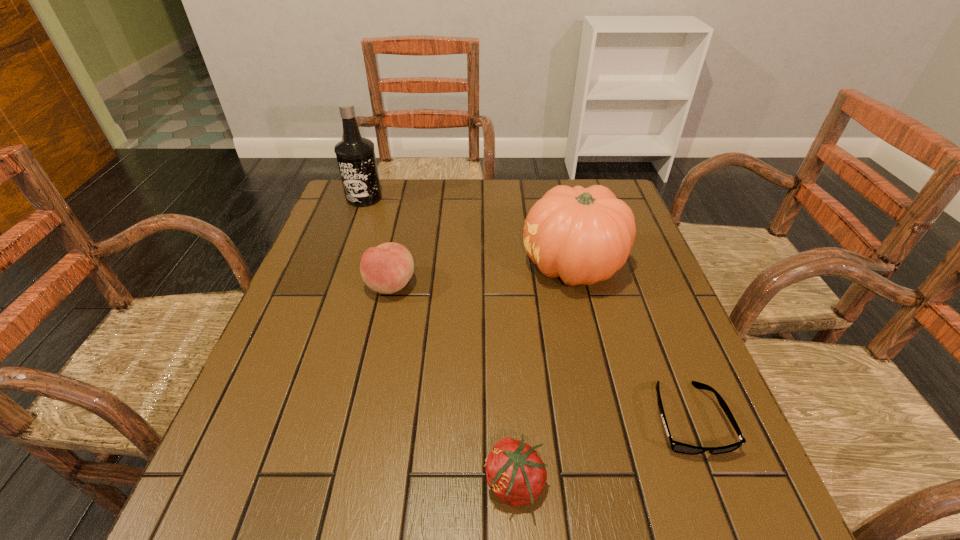
Where is `free space between the tomato and the sunglasses`? This screenshot has width=960, height=540. free space between the tomato and the sunglasses is located at coordinates (601, 451).

The height and width of the screenshot is (540, 960). I want to click on unoccupied position between the pumpkin and the third tallest object, so [482, 275].

Locate an element on the screen. vacant area that lies between the tomato and the third tallest object is located at coordinates (452, 384).

This screenshot has height=540, width=960. Identify the location of empty space between the tomato and the third shortest object. (452, 384).

I want to click on vacant area that lies between the tomato and the liquor, so click(440, 341).

Identify the location of object that is the closest one to the second tallest object. (678, 447).

Select which object is the closest to the pumpkin. Please provide its 2D coordinates. Your answer should be formatted as a tuple, i.e. [(x, y)], where the tuple contains the x and y coordinates of a point satisfying the conditions above.

[(678, 447)]

Identify the location of vacant space that satisfies the following two spatial constraints: 1. on the front side of the second shortest object; 2. on the right side of the peach. (347, 484).

Identify the location of vacant space that satisfies the following two spatial constraints: 1. on the front label of the tomato; 2. on the right side of the liquor. The width and height of the screenshot is (960, 540). (261, 484).

Locate an element on the screen. vacant point that satisfies the following two spatial constraints: 1. on the front label of the leftmost object; 2. on the right side of the third shortest object is located at coordinates (333, 285).